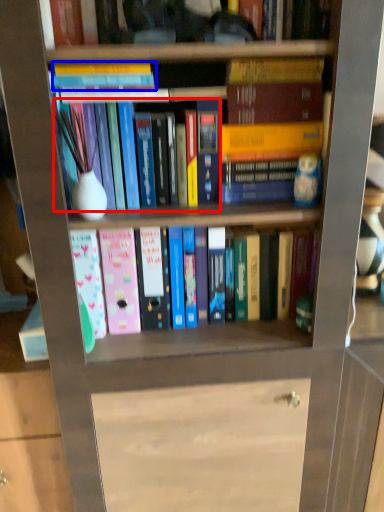
Question: Among these objects, which one is farthest to the camera, book (highlighted by a red box) or book (highlighted by a blue box)?

Choices:
 (A) book
 (B) book

Answer: (A)